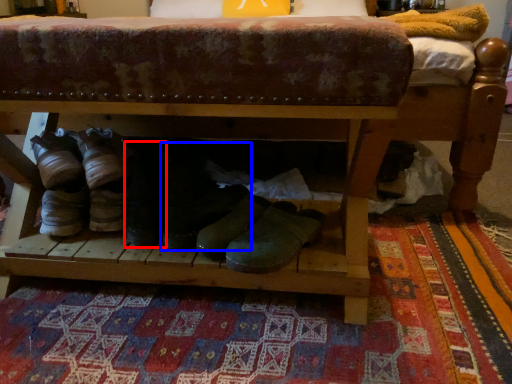
Question: Which of the following is the farthest to the observer, footwear (highlighted by a red box) or footwear (highlighted by a blue box)?

Choices:
 (A) footwear
 (B) footwear

Answer: (A)